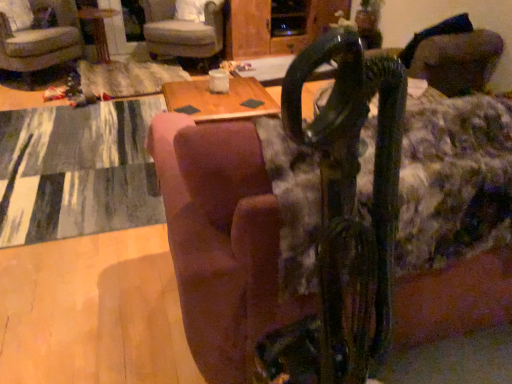
Question: In terms of height, does velvet-like gray armchair at upper center, which is the first chair in right-to-left order, look taller or shorter compared to wooden table at center?

Choices:
 (A) tall
 (B) short

Answer: (A)

Question: In the image, is velvet-like gray armchair at upper center, which is the first chair in right-to-left order, on the left side or the right side of wooden table at center?

Choices:
 (A) right
 (B) left

Answer: (A)

Question: Considering the real-world distances, which object is farthest from the textured gray rug at lower left?

Choices:
 (A) brown fabric couch at center
 (B) wooden table at center
 (C) velvet-like gray armchair at upper center, arranged as the second chair when viewed from the left
 (D) velvet beige armchair at upper left, which appears as the 1th chair when viewed from the left

Answer: (B)

Question: Estimate the real-world distances between objects in this image. Which object is farther from the velvet-like gray armchair at upper center, which is the first chair in right-to-left order?

Choices:
 (A) velvet beige armchair at upper left, which appears as the 1th chair when viewed from the left
 (B) textured gray rug at lower left
 (C) wooden table at center
 (D) brown fabric couch at center

Answer: (D)